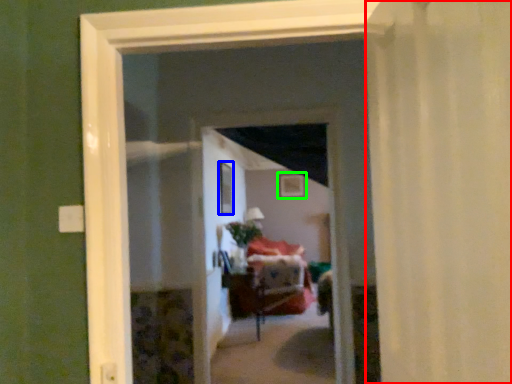
Question: Based on their relative distances, which object is nearer to curtain (highlighted by a red box)? Choose from window (highlighted by a blue box) and picture frame (highlighted by a green box).

Choices:
 (A) window
 (B) picture frame

Answer: (A)